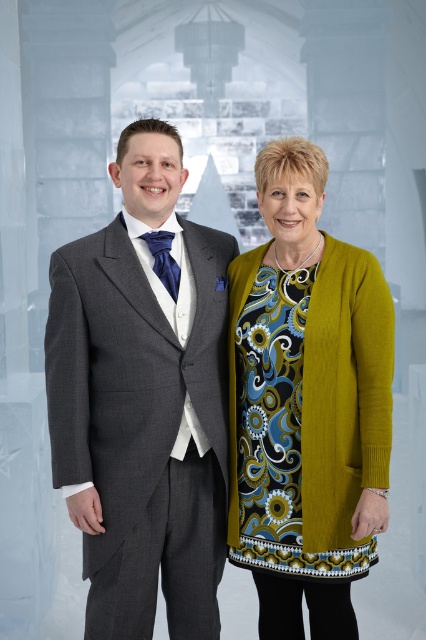
Is charcoal gray suit at left below green textured cardigan at right?

Actually, charcoal gray suit at left is above green textured cardigan at right.

This screenshot has width=426, height=640. I want to click on charcoal gray suit at left, so click(143, 397).